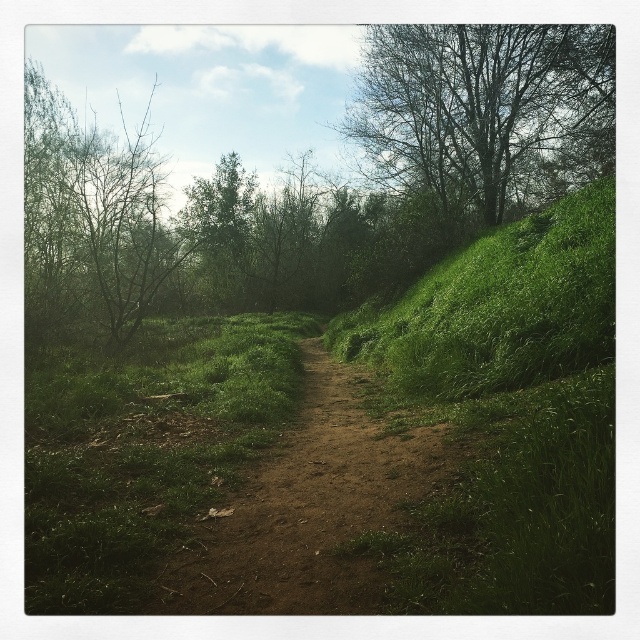
Can you confirm if green leafy tree at upper right is positioned below green leafy tree at upper center?

Correct, green leafy tree at upper right is located below green leafy tree at upper center.

Describe the element at coordinates (476, 104) in the screenshot. I see `green leafy tree at upper right` at that location.

Locate an element on the screen. The width and height of the screenshot is (640, 640). green leafy tree at upper right is located at coordinates click(x=476, y=104).

Who is lower down, green leafy tree at upper right or bare branches at left?

green leafy tree at upper right

Is green leafy tree at upper right above bare branches at left?

No.

Is point (502, 182) positioned before point (28, 96)?

That is True.

Image resolution: width=640 pixels, height=640 pixels. I want to click on green leafy tree at upper right, so click(476, 104).

Which is in front, point (131, 262) or point (209, 253)?

Point (131, 262) is more forward.

Can you confirm if bare branches at left is positioned to the right of green leafy tree at upper center?

Incorrect, bare branches at left is not on the right side of green leafy tree at upper center.

At what (x,y) coordinates should I click in order to perform the action: click on bare branches at left. Please return your answer as a coordinate pair (x, y). Looking at the image, I should click on (92, 216).

At what (x,y) coordinates should I click in order to perform the action: click on bare branches at left. Please return your answer as a coordinate pair (x, y). Looking at the image, I should click on (92, 216).